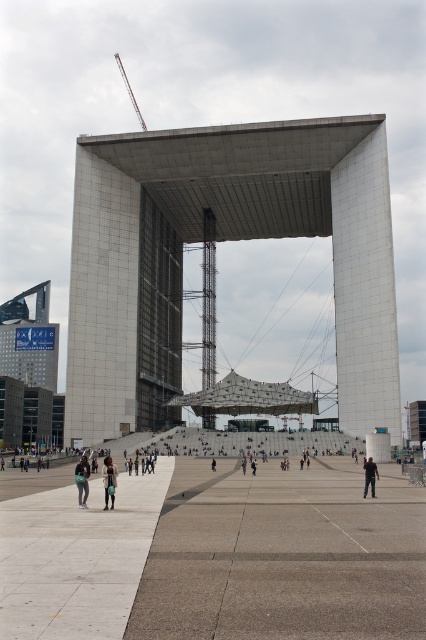
Between dark blue jeans at lower left and light brown leather jacket at lower center, which one has less height?

Standing shorter between the two is dark blue jeans at lower left.

Which is behind, point (86, 490) or point (103, 472)?

Point (103, 472)

Where is `dark blue jeans at lower left`? dark blue jeans at lower left is located at coordinates (81, 481).

Does point (112, 340) come farther from viewer compared to point (83, 497)?

Yes, point (112, 340) is behind point (83, 497).

Is point (241, 145) less distant than point (83, 486)?

No, (241, 145) is behind (83, 486).

In order to click on white concrete structure at center in this screenshot , I will do `click(218, 241)`.

Consider the image. Is matte glass tower at lower left to the right of dark gray fabric at center from the viewer's perspective?

No, matte glass tower at lower left is not to the right of dark gray fabric at center.

How distant is matte glass tower at lower left from dark gray fabric at center?

matte glass tower at lower left and dark gray fabric at center are 649.86 feet apart from each other.

Which is in front, point (19, 374) or point (363, 486)?

Positioned in front is point (363, 486).

At what (x,y) coordinates should I click in order to perform the action: click on matte glass tower at lower left. Please return your answer as a coordinate pair (x, y). The image size is (426, 640). Looking at the image, I should click on (28, 339).